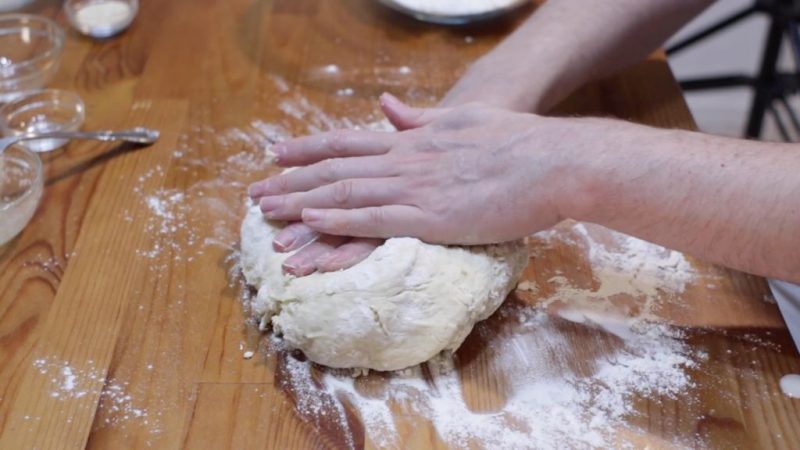
This screenshot has width=800, height=450. What are the coordinates of `one visible piece of silverware` in the screenshot? It's located at (130, 135).